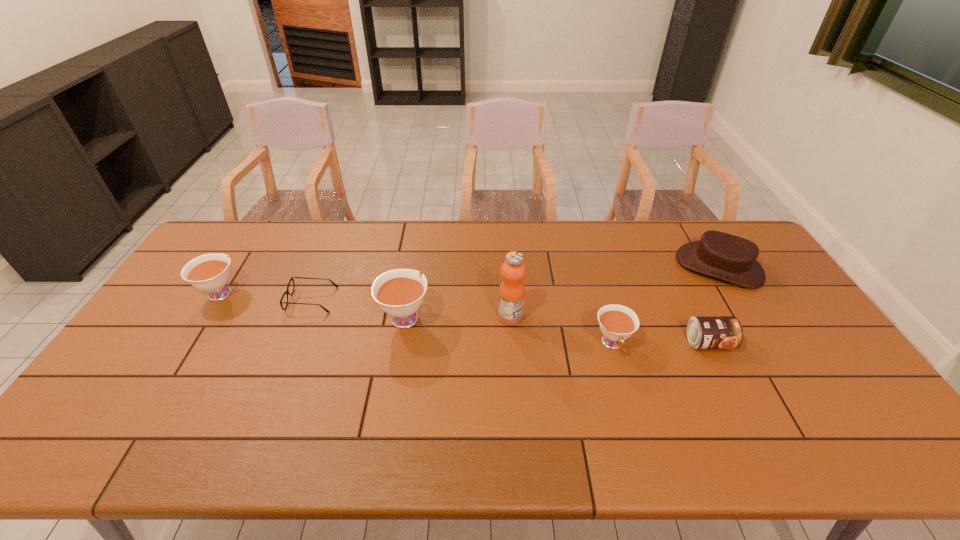
Identify the location of the leftmost object. The height and width of the screenshot is (540, 960). (210, 272).

Where is `the second shortest teacup`? Image resolution: width=960 pixels, height=540 pixels. the second shortest teacup is located at coordinates (210, 272).

Locate an element on the screen. the second teacup from right to left is located at coordinates (399, 292).

Image resolution: width=960 pixels, height=540 pixels. What are the coordinates of `the rightmost teacup` in the screenshot? It's located at (617, 323).

You are a GUI agent. You are given a task and a screenshot of the screen. Output one action in this format:
    pyautogui.click(x=<x>, y=<y>)
    Task: Click on the third object from right to left
    
    Given the screenshot: What is the action you would take?
    pyautogui.click(x=617, y=323)

In order to click on hat in this screenshot , I will do `click(717, 254)`.

I want to click on the fourth object from right to left, so click(x=513, y=271).

Image resolution: width=960 pixels, height=540 pixels. In order to click on fruit juice in this screenshot , I will do point(513,271).

The image size is (960, 540). In order to click on the sixth object from right to left in this screenshot , I will do `click(292, 278)`.

Identify the location of spectacles. The width and height of the screenshot is (960, 540). (292, 278).